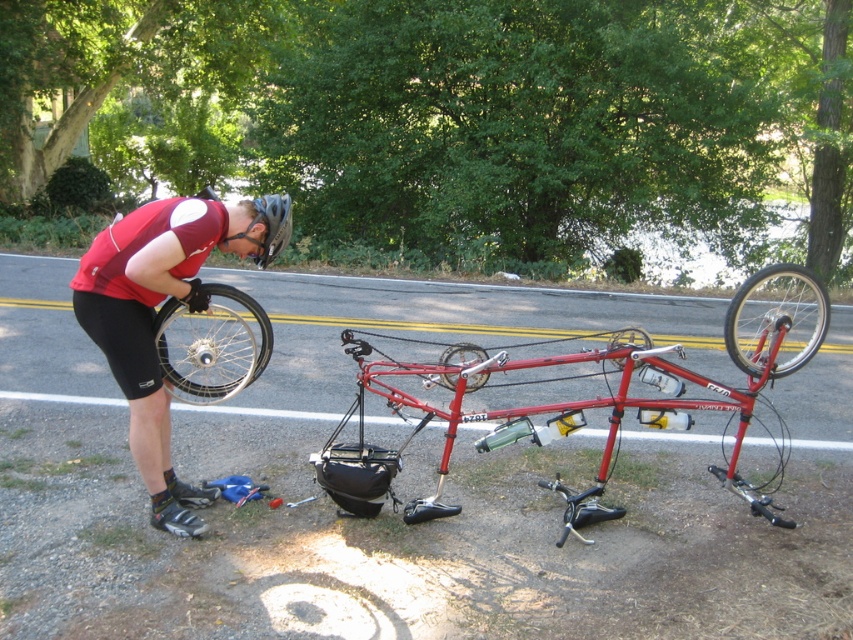
Looking at this image, you are a photographer trying to capture the cyclist and the bike. You want to frame the shot so that the matte black shorts at left and the metallic silver wheel at center are both visible. Based on their positions, which object should be placed closer to the left edge of the photo?

The matte black shorts at left should be placed closer to the left edge of the photo since they are positioned to the left of the metallic silver wheel at center.

You are a delivery person who needs to move the shiny silver rim at left and the red matte bicycle at center to a storage area. The storage area has a 3.5 meter wide entrance. Can both items fit through the entrance if placed side by side?

The red matte bicycle at center and shiny silver rim at left are 3.63 meters apart from each other. Since the entrance is only 3.5 meters wide, placing them side by side would exceed the width limit, so they cannot both fit through the entrance together.

You are a mechanic inspecting the recumbent bicycle. You notice the metallic silver wheel at right and the matte black tire at center. Which object is positioned higher from the ground?

The metallic silver wheel at right is above the matte black tire at center, so it is positioned higher from the ground.